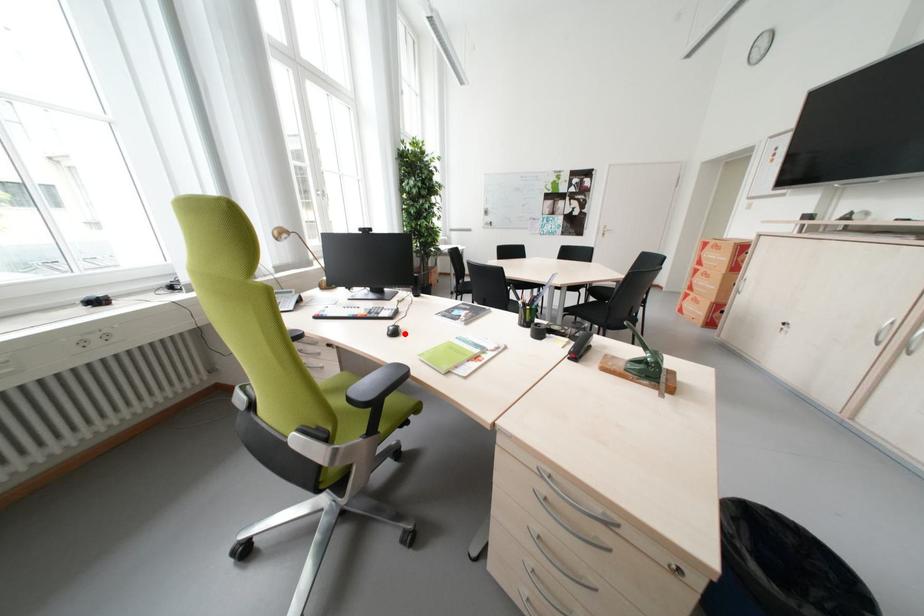
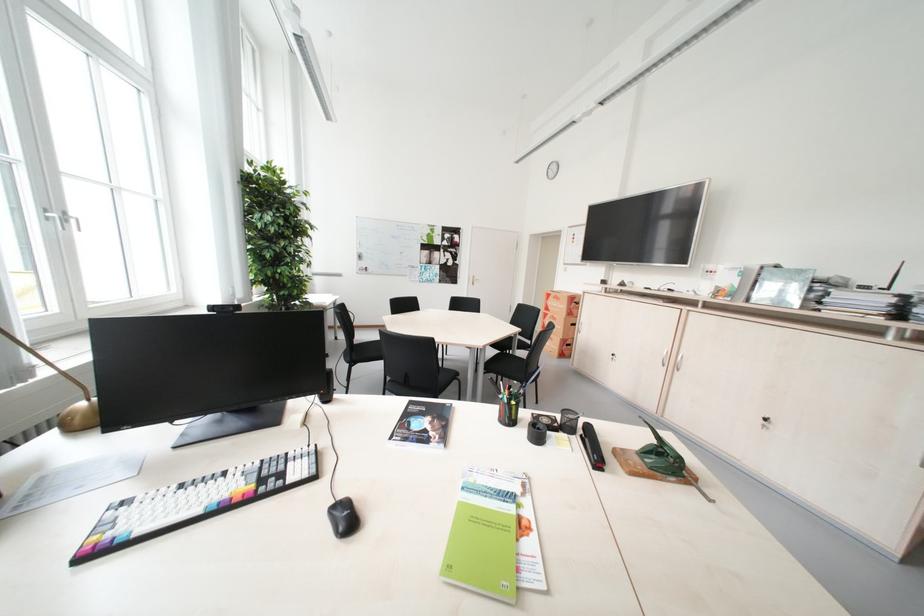
Question: I am providing you with two images of the same scene from different viewpoints. Image1 has a red point marked. In image2, the corresponding 3D location appears at what relative position? Reply with the corresponding letter.

Choices:
 (A) Closer
 (B) Farther

Answer: (B)